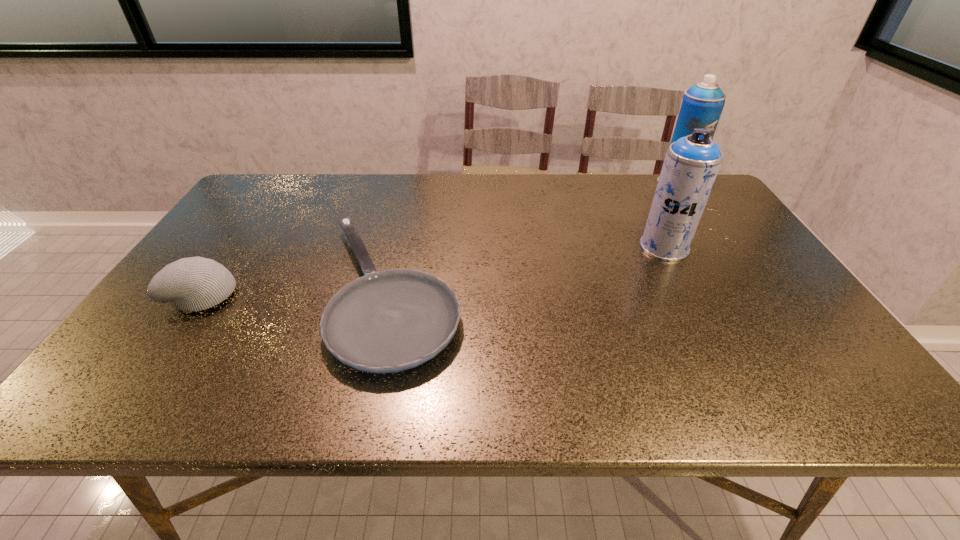
You are a GUI agent. You are given a task and a screenshot of the screen. Output one action in this format:
    pyautogui.click(x=<x>, y=<y>)
    Task: Click on the free space that satisfies the following two spatial constraints: 1. on the back side of the leftmost object; 2. on the left side of the third object from left to right
    This screenshot has height=540, width=960.
    Given the screenshot: What is the action you would take?
    pyautogui.click(x=236, y=247)

Locate an element on the screen. The height and width of the screenshot is (540, 960). free space that satisfies the following two spatial constraints: 1. on the back side of the leftmost object; 2. on the left side of the second object from right to left is located at coordinates (236, 247).

Find the location of a particular element. The width and height of the screenshot is (960, 540). free point that satisfies the following two spatial constraints: 1. on the back side of the beanie; 2. on the left side of the left aerosol can is located at coordinates (236, 247).

Identify the location of free space that satisfies the following two spatial constraints: 1. on the back side of the third object from right to left; 2. on the right side of the left aerosol can. The width and height of the screenshot is (960, 540). (400, 247).

Locate an element on the screen. The image size is (960, 540). free location that satisfies the following two spatial constraints: 1. on the back side of the beanie; 2. on the left side of the rightmost object is located at coordinates (279, 184).